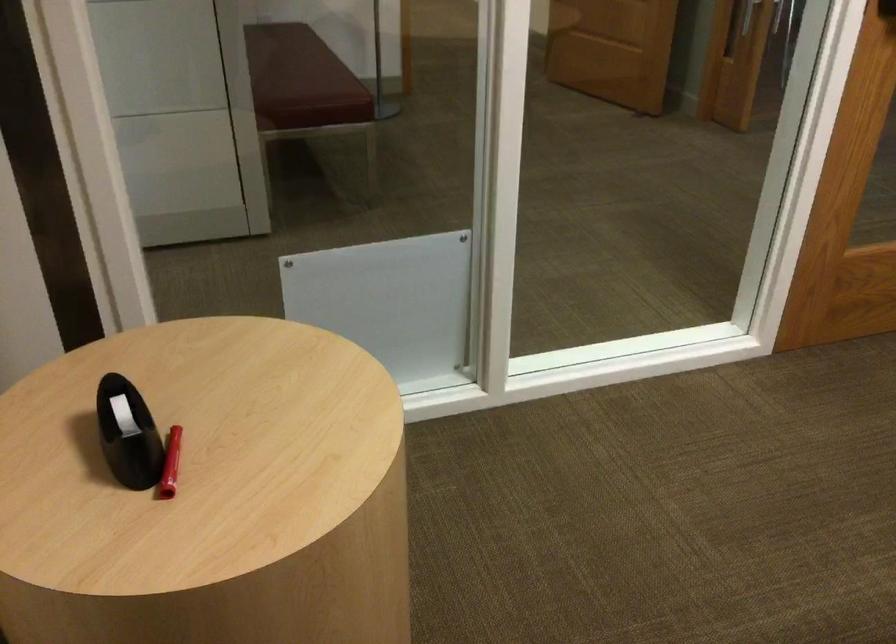
Locate an element on the screen. Image resolution: width=896 pixels, height=644 pixels. red marker is located at coordinates (170, 464).